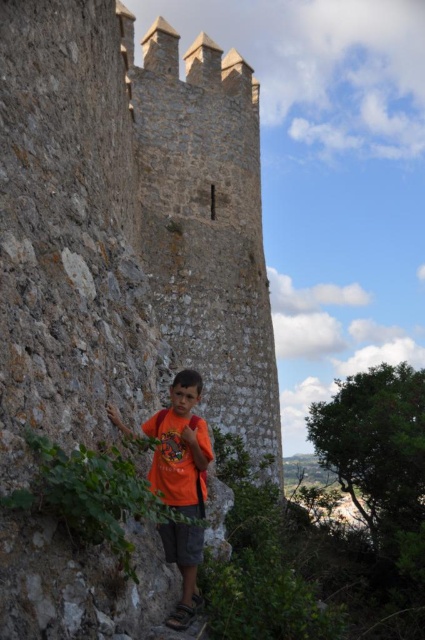
You are a photographer trying to capture the rustic stone tower at center in your shot. You notice a point marked at coordinates [127,228]. Where does this point likely correspond to in the scene?

The point at coordinates [127,228] corresponds to the rustic stone tower at center, so you should focus your camera there to capture the tower.

You are standing at the base of the medieval stone wall and want to reach the point marked at coordinates (116, 387). Given that the wall is 35 meters tall, can you estimate if the point is within your reach without any climbing equipment?

The point at coordinates (116, 387) is 35.03 meters away from the viewer. Since the wall is 35 meters tall, the point is likely at the very top of the wall, making it unreachable without climbing equipment.

Based on the photo, you are a photographer trying to capture the boy in the orange cotton shirt at center and the rustic stone tower at center. Since the tower is positioned to the right of the shirt, where should you place the shirt in your camera frame to ensure both are visible?

The rustic stone tower at center is to the right of the orange cotton shirt at center, so you should position the orange cotton shirt at center on the left side of the frame to include both the shirt and the tower in the photo.